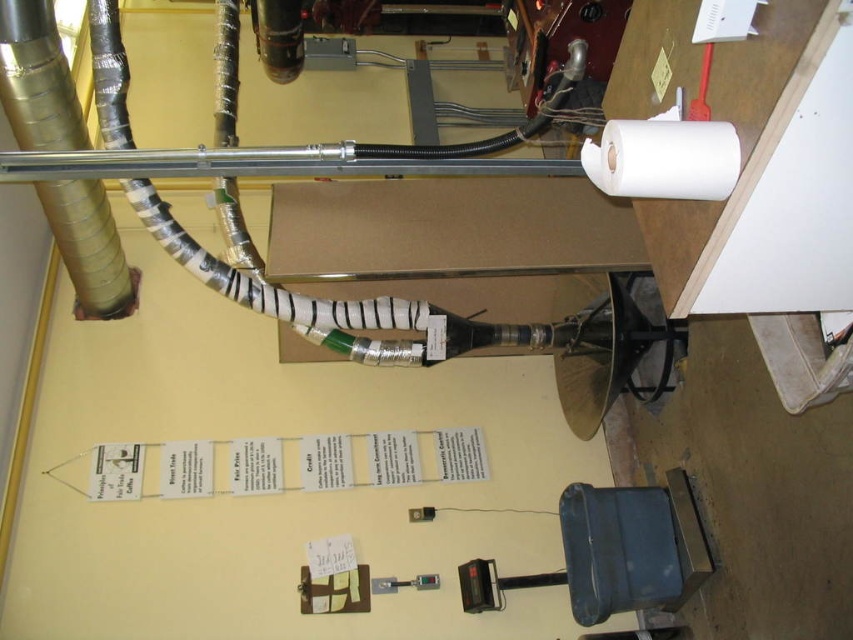
You are a technician in a lab. You need to access both the gold metallic pipe at left and the white matte toilet paper at upper right. Which one is higher up in the image?

The gold metallic pipe at left is taller than the white matte toilet paper at upper right, so the gold metallic pipe at left is higher up in the image.

You are standing in the workspace and want to reach a tool located at point (653, 118). There is an obstacle at point (51, 90) blocking your path. Can you walk around the obstacle to reach your destination?

Point (51, 90) is closer to you than point (653, 118), so you can walk around the obstacle at point (51, 90) to reach the tool at point (653, 118).